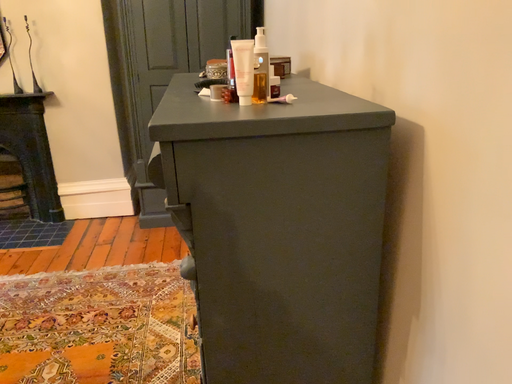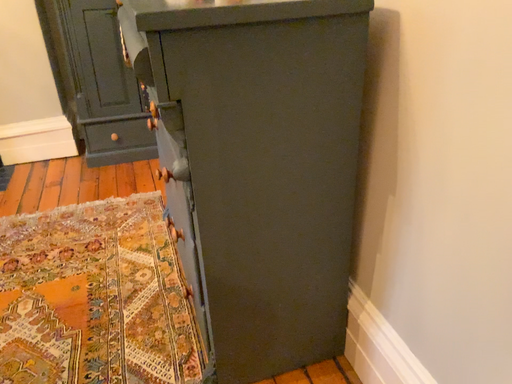
Question: Which way did the camera rotate in the video?

Choices:
 (A) rotated right
 (B) rotated left

Answer: (A)